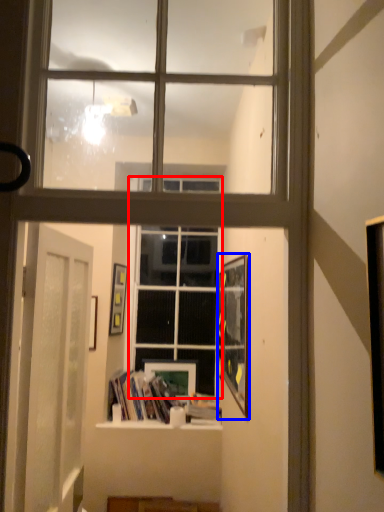
Question: Among these objects, which one is farthest to the camera, window (highlighted by a red box) or picture frame (highlighted by a blue box)?

Choices:
 (A) window
 (B) picture frame

Answer: (A)